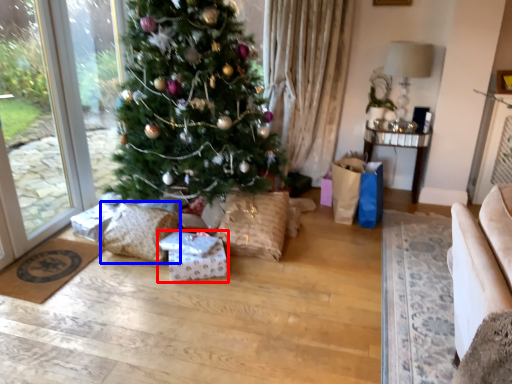
Question: Which object appears closest to the camera in this image, package (highlighted by a red box) or pillow (highlighted by a blue box)?

Choices:
 (A) package
 (B) pillow

Answer: (A)